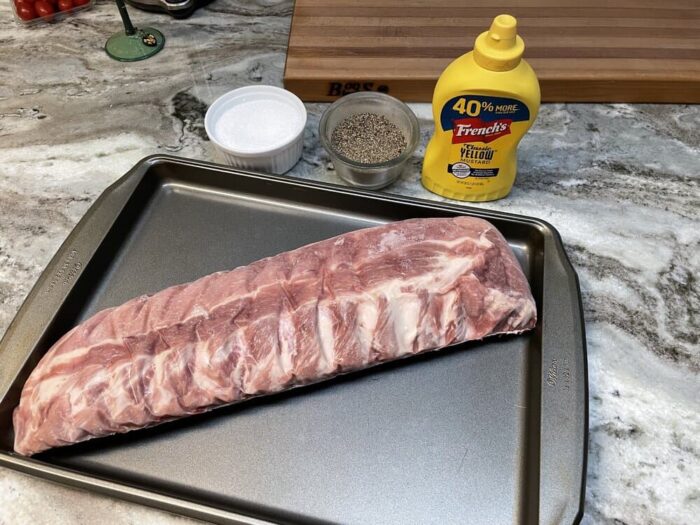
Find the location of a particular element. The image size is (700, 525). white spice cup is located at coordinates (276, 151).